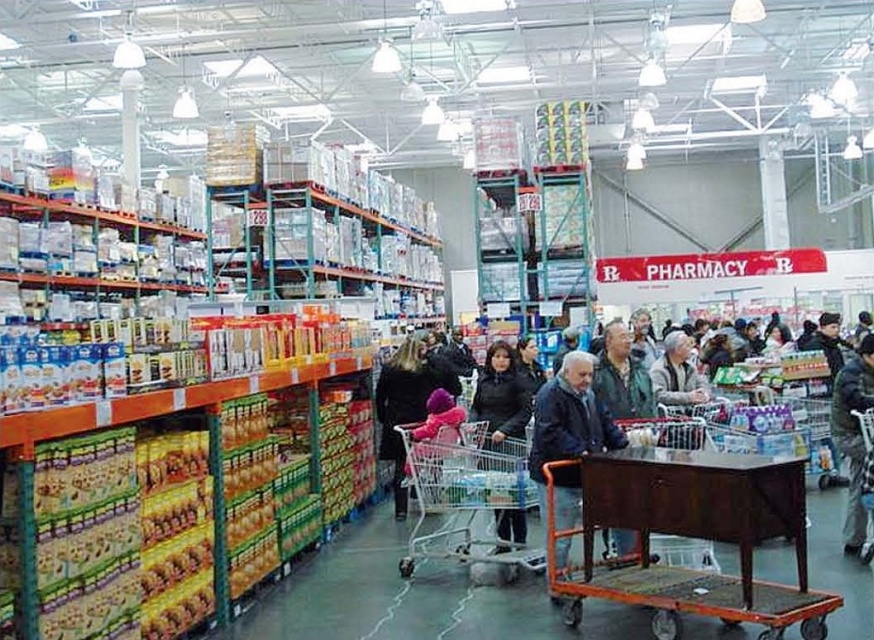
This screenshot has height=640, width=874. Find the location of `wooden table at center`. wooden table at center is located at coordinates (687, 536).

Does wooden table at center appear under metallic silver shopping cart at center?

No.

Who is more forward, (809, 637) or (475, 524)?

Point (809, 637) is in front.

I want to click on wooden table at center, so click(x=687, y=536).

Can you confirm if metallic silver shopping cart at center is bigger than dark blue jacket at center?

Correct, metallic silver shopping cart at center is larger in size than dark blue jacket at center.

Consider the image. Is metallic silver shopping cart at center in front of dark blue jacket at center?

No, metallic silver shopping cart at center is behind dark blue jacket at center.

Who is more forward, (456, 499) or (560, 368)?

Point (456, 499) is more forward.

You are a GUI agent. You are given a task and a screenshot of the screen. Output one action in this format:
    pyautogui.click(x=<x>, y=<y>)
    Task: Click on the metallic silver shopping cart at center
    This screenshot has width=874, height=640.
    Given the screenshot: What is the action you would take?
    pyautogui.click(x=466, y=497)

Which of these two, wooden table at center or dark gray coat at center, stands shorter?

With less height is wooden table at center.

This screenshot has height=640, width=874. In order to click on wooden table at center in this screenshot , I will do `click(687, 536)`.

Where is `wooden table at center`? The image size is (874, 640). wooden table at center is located at coordinates (687, 536).

Find the location of a particular element. wooden table at center is located at coordinates (687, 536).